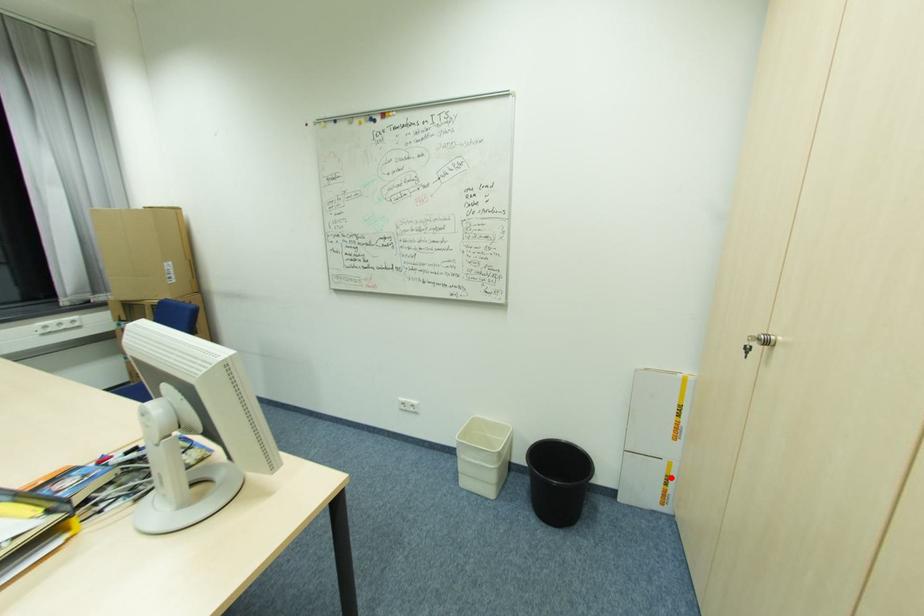
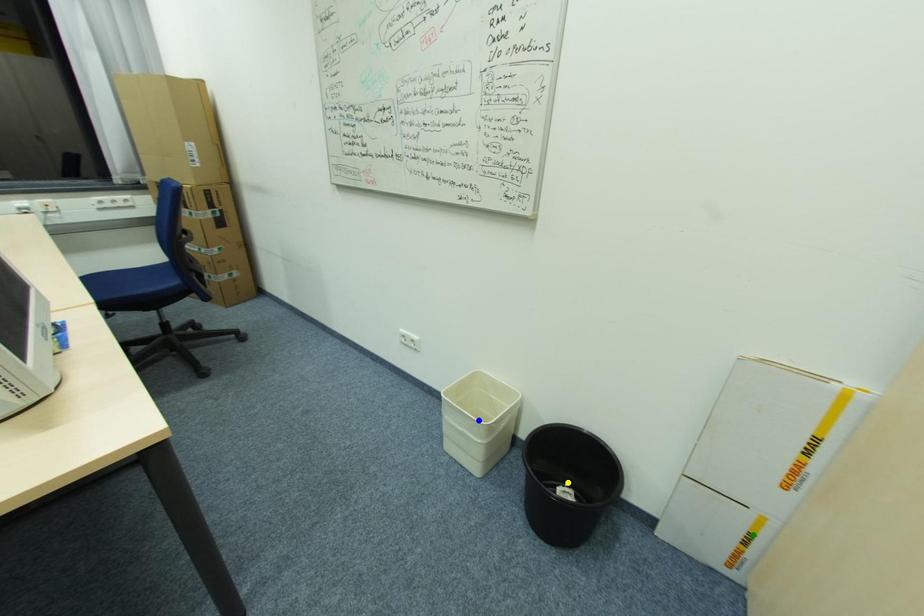
Question: I am providing you with two images of the same scene from different viewpoints. A red point is marked on the first image. You are given multiple points on the second image. Can you choose the point in image 2 that corresponds to the point in image 1?

Choices:
 (A) blue point
 (B) yellow point
 (C) green point

Answer: (C)